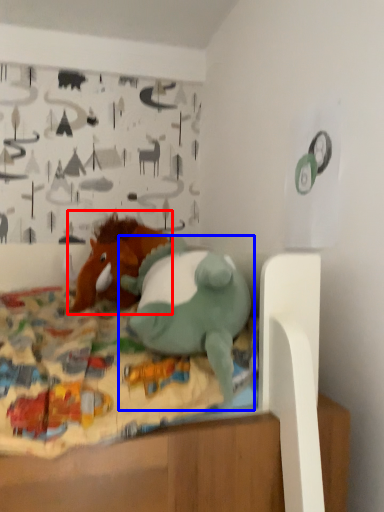
Question: Which of the following is the farthest to the observer, toy (highlighted by a red box) or toy (highlighted by a blue box)?

Choices:
 (A) toy
 (B) toy

Answer: (A)